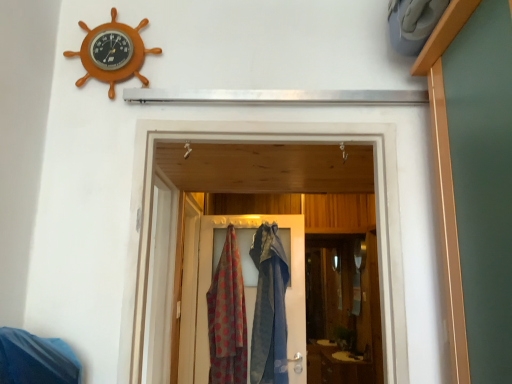
Question: Considering the relative positions of textured fabric door at center and polka dot fabric scarf at center in the image provided, is textured fabric door at center in front of polka dot fabric scarf at center?

Choices:
 (A) yes
 (B) no

Answer: (B)

Question: From the image's perspective, is textured fabric door at center above polka dot fabric scarf at center?

Choices:
 (A) no
 (B) yes

Answer: (B)

Question: Is textured fabric door at center smaller than polka dot fabric scarf at center?

Choices:
 (A) yes
 (B) no

Answer: (B)

Question: Is polka dot fabric scarf at center at the back of textured fabric door at center?

Choices:
 (A) yes
 (B) no

Answer: (A)

Question: Does textured fabric door at center have a lesser height compared to polka dot fabric scarf at center?

Choices:
 (A) yes
 (B) no

Answer: (B)

Question: From a real-world perspective, is polka dot fabric scarf at center positioned above or below orange wooden ship wheel at upper left?

Choices:
 (A) below
 (B) above

Answer: (A)

Question: Does point (218, 336) appear closer or farther from the camera than point (124, 49)?

Choices:
 (A) closer
 (B) farther

Answer: (B)

Question: From their relative heights in the image, would you say polka dot fabric scarf at center is taller or shorter than orange wooden ship wheel at upper left?

Choices:
 (A) tall
 (B) short

Answer: (A)

Question: Considering their positions, is polka dot fabric scarf at center located in front of or behind orange wooden ship wheel at upper left?

Choices:
 (A) behind
 (B) front

Answer: (A)

Question: Is textured fabric door at center inside or outside of orange wooden ship wheel at upper left?

Choices:
 (A) outside
 (B) inside

Answer: (A)

Question: Looking at the image, does textured fabric door at center seem bigger or smaller compared to orange wooden ship wheel at upper left?

Choices:
 (A) big
 (B) small

Answer: (A)

Question: Does point (301, 249) appear closer or farther from the camera than point (143, 21)?

Choices:
 (A) farther
 (B) closer

Answer: (A)

Question: Based on their positions, is textured fabric door at center located to the left or right of orange wooden ship wheel at upper left?

Choices:
 (A) right
 (B) left

Answer: (A)

Question: Is orange wooden ship wheel at upper left bigger or smaller than textured fabric door at center?

Choices:
 (A) small
 (B) big

Answer: (A)

Question: In terms of width, does orange wooden ship wheel at upper left look wider or thinner when compared to textured fabric door at center?

Choices:
 (A) thin
 (B) wide

Answer: (A)